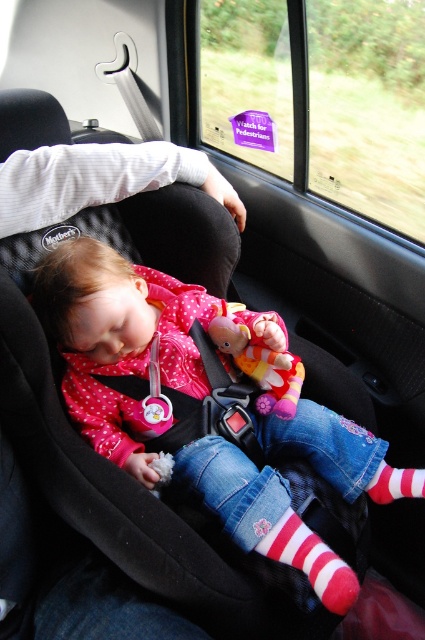
What do you see at coordinates (99, 180) in the screenshot? I see `white fabric at upper left` at bounding box center [99, 180].

Can you confirm if white fabric at upper left is positioned to the right of striped cotton sock at lower center?

No, white fabric at upper left is not to the right of striped cotton sock at lower center.

The image size is (425, 640). I want to click on white fabric at upper left, so click(x=99, y=180).

Identify the location of white fabric at upper left. (99, 180).

Does point (235, 209) come closer to viewer compared to point (231, 317)?

No, it is behind (231, 317).

Is white fabric at upper left bigger than fluffy fabric doll at center?

Yes, white fabric at upper left is bigger than fluffy fabric doll at center.

Image resolution: width=425 pixels, height=640 pixels. I want to click on white fabric at upper left, so 99,180.

Which is more to the left, fluffy fabric doll at center or striped cotton sock at lower right?

From the viewer's perspective, fluffy fabric doll at center appears more on the left side.

The height and width of the screenshot is (640, 425). What do you see at coordinates (260, 364) in the screenshot?
I see `fluffy fabric doll at center` at bounding box center [260, 364].

Locate an element on the screen. The width and height of the screenshot is (425, 640). fluffy fabric doll at center is located at coordinates (260, 364).